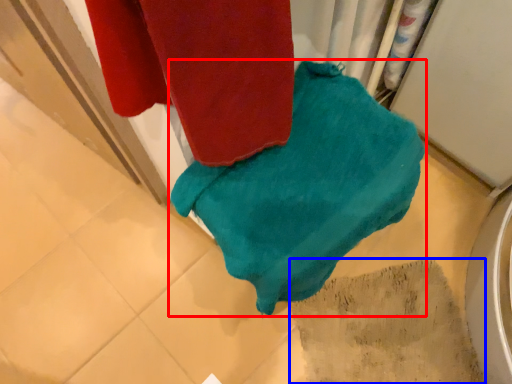
Question: Among these objects, which one is farthest to the camera, towel (highlighted by a red box) or tile (highlighted by a blue box)?

Choices:
 (A) towel
 (B) tile

Answer: (B)